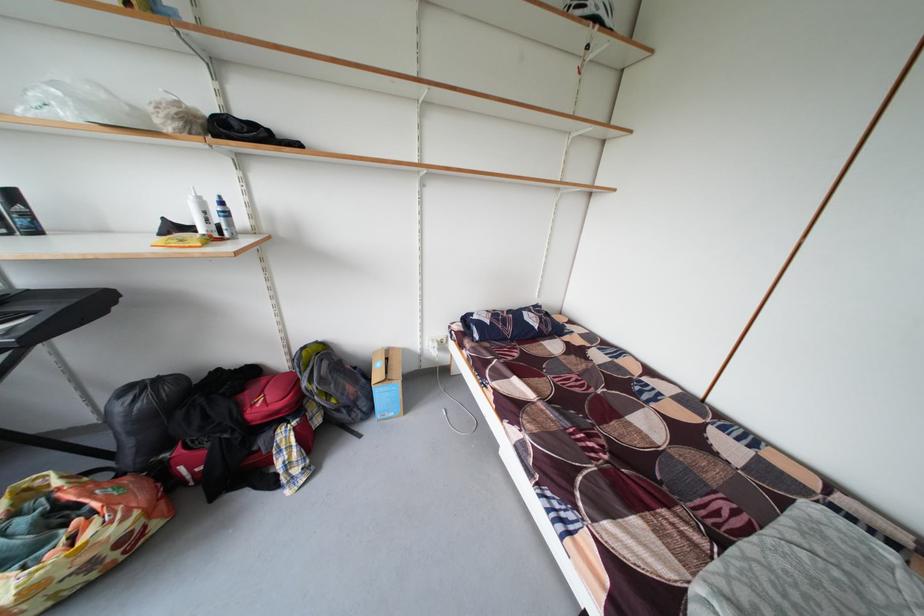
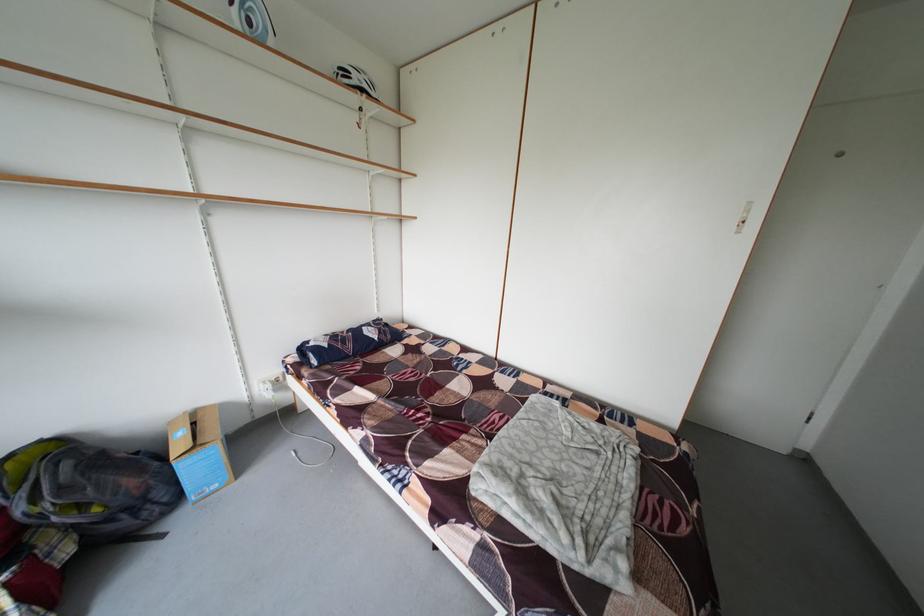
Locate, in the second image, the point that corresponds to [735,512] in the first image.

(506, 422)